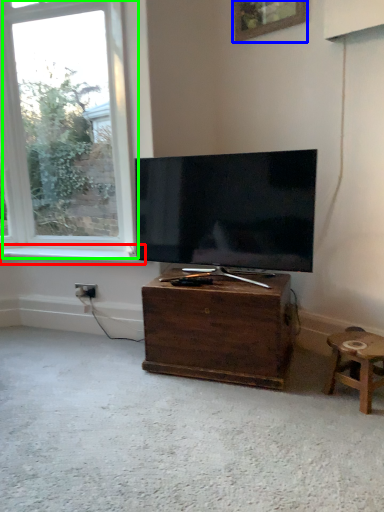
Question: Which object is positioned closest to window sill (highlighted by a red box)? Select from picture frame (highlighted by a blue box) and window (highlighted by a green box).

Choices:
 (A) picture frame
 (B) window

Answer: (B)